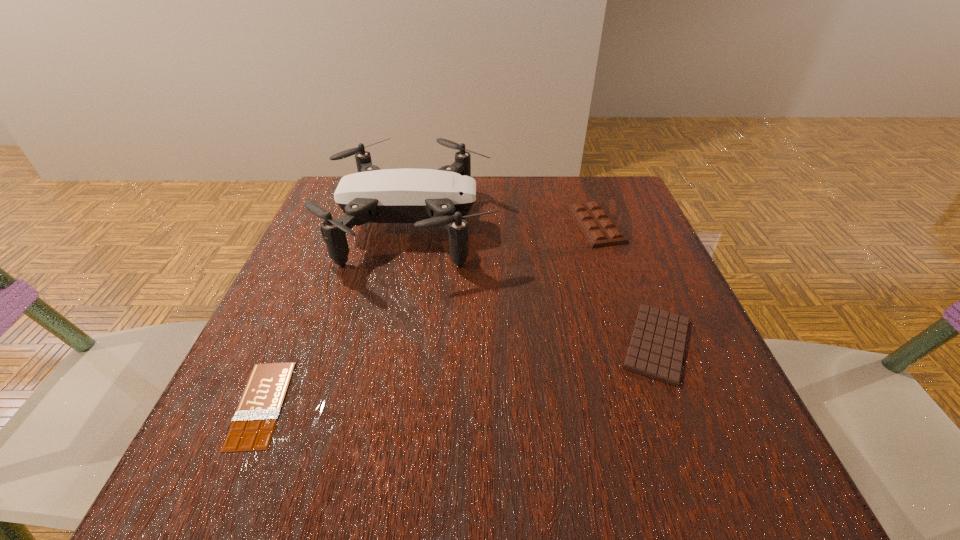
The height and width of the screenshot is (540, 960). What are the coordinates of `drone at the far edge` in the screenshot? It's located at (429, 198).

The image size is (960, 540). Identify the location of chocolate bar that is positioned at the far edge. (599, 229).

The width and height of the screenshot is (960, 540). I want to click on object present at the near edge, so click(252, 428).

Locate an element on the screen. drone that is at the left edge is located at coordinates (429, 198).

Locate an element on the screen. The image size is (960, 540). chocolate bar that is at the left edge is located at coordinates (252, 428).

At what (x,y) coordinates should I click in order to perform the action: click on object situated at the far left corner. Please return your answer as a coordinate pair (x, y). Image resolution: width=960 pixels, height=540 pixels. Looking at the image, I should click on (429, 198).

Where is `object that is at the near left corner`? The image size is (960, 540). object that is at the near left corner is located at coordinates (252, 428).

This screenshot has height=540, width=960. Identify the location of object present at the far right corner. (599, 229).

Identify the location of vacant space at the far edge of the desktop. Image resolution: width=960 pixels, height=540 pixels. (532, 218).

I want to click on free point at the near edge, so click(x=476, y=454).